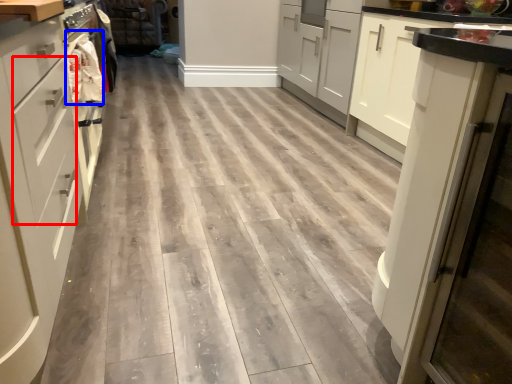
Question: Which object appears closest to the camera in this image, drawer (highlighted by a red box) or material (highlighted by a blue box)?

Choices:
 (A) drawer
 (B) material

Answer: (A)